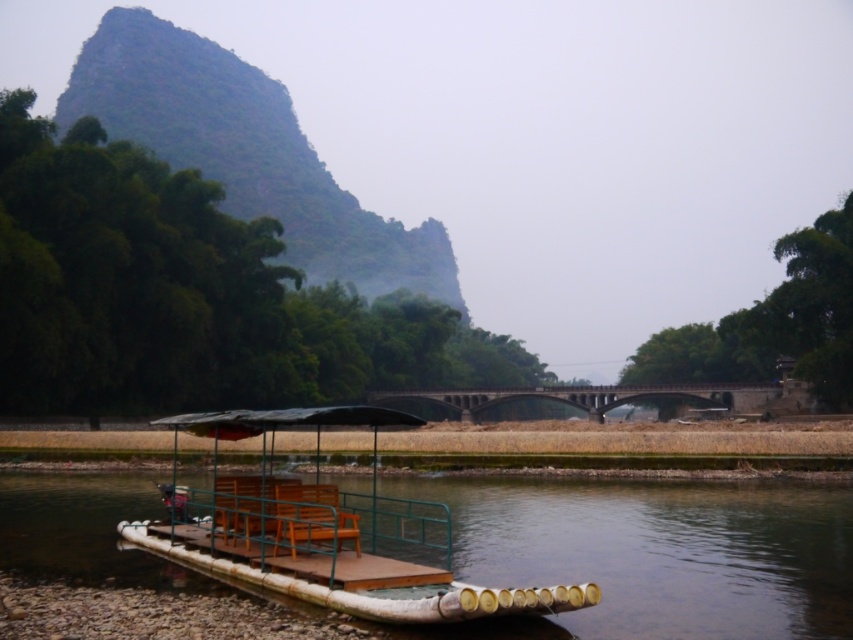
You are standing on the bamboo raft and want to take a photo of both point (682,493) and point (373,547). Which point should you focus on first to ensure both are in the frame?

You should focus on point (682,493) first because it is closer to you than point (373,547). This ensures that both points will be within the camera frame when adjusted properly.